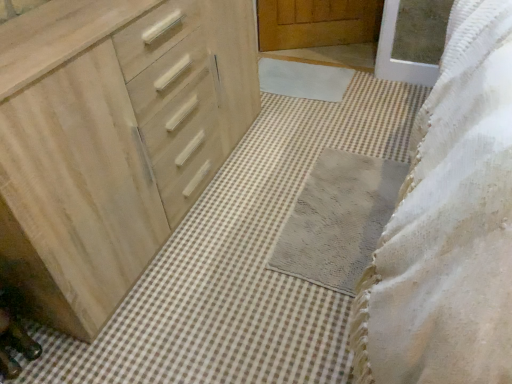
Find the location of a particular element. white soft bath mat at center, arranged as the 1th bath mat when viewed from the top is located at coordinates (303, 79).

Locate an element on the screen. This screenshot has height=384, width=512. natural wood chest of drawers at left is located at coordinates (112, 139).

From a real-world perspective, does white soft bath mat at center, arranged as the second bath mat when ordered from the bottom, stand above natural wood chest of drawers at left?

No, from a real-world perspective, white soft bath mat at center, arranged as the second bath mat when ordered from the bottom, is not over natural wood chest of drawers at left

From the image's perspective, is white soft bath mat at center, arranged as the second bath mat when ordered from the bottom, located above or below natural wood chest of drawers at left?

white soft bath mat at center, arranged as the second bath mat when ordered from the bottom, is above natural wood chest of drawers at left.

Is white soft bath mat at center, arranged as the second bath mat when ordered from the bottom, turned away from natural wood chest of drawers at left?

That's not correct — white soft bath mat at center, arranged as the second bath mat when ordered from the bottom, is not looking away from natural wood chest of drawers at left.

Considering the relative sizes of white soft bath mat at center, marked as the first bath mat in a back-to-front arrangement, and natural wood chest of drawers at left in the image provided, is white soft bath mat at center, marked as the first bath mat in a back-to-front arrangement, shorter than natural wood chest of drawers at left?

Correct, white soft bath mat at center, marked as the first bath mat in a back-to-front arrangement, is not as tall as natural wood chest of drawers at left.

Which object is thinner, gray textured bath mat at center, the 2th bath mat positioned from the back, or natural wood chest of drawers at left?

natural wood chest of drawers at left is thinner.

Considering the sizes of objects gray textured bath mat at center, which ranks as the 2th bath mat in top-to-bottom order, and natural wood chest of drawers at left in the image provided, who is smaller, gray textured bath mat at center, which ranks as the 2th bath mat in top-to-bottom order, or natural wood chest of drawers at left?

gray textured bath mat at center, which ranks as the 2th bath mat in top-to-bottom order, is smaller.

In the image, is gray textured bath mat at center, the 2th bath mat positioned from the back, on the left side or the right side of natural wood chest of drawers at left?

In the image, gray textured bath mat at center, the 2th bath mat positioned from the back, appears on the right side of natural wood chest of drawers at left.

Which is in front, point (348, 164) or point (199, 151)?

The point (199, 151) is more forward.

Considering the positions of point (0, 29) and point (316, 96), is point (0, 29) closer or farther from the camera than point (316, 96)?

Point (0, 29) is positioned closer to the camera compared to point (316, 96).

Looking at their sizes, would you say natural wood chest of drawers at left is wider or thinner than white soft bath mat at center, marked as the first bath mat in a back-to-front arrangement?

Clearly, natural wood chest of drawers at left has less width compared to white soft bath mat at center, marked as the first bath mat in a back-to-front arrangement.

Could you tell me if natural wood chest of drawers at left is turned towards white soft bath mat at center, arranged as the second bath mat when ordered from the bottom?

No, natural wood chest of drawers at left is not turned towards white soft bath mat at center, arranged as the second bath mat when ordered from the bottom.

Does gray textured bath mat at center, the 1th bath mat from the front, have a larger size compared to white soft bath mat at center, marked as the first bath mat in a back-to-front arrangement?

Yes, gray textured bath mat at center, the 1th bath mat from the front, is bigger than white soft bath mat at center, marked as the first bath mat in a back-to-front arrangement.

You are a GUI agent. You are given a task and a screenshot of the screen. Output one action in this format:
    pyautogui.click(x=<x>, y=<y>)
    Task: Click on the bath mat on the left of gray textured bath mat at center, the 1th bath mat from the front
    The width and height of the screenshot is (512, 384).
    Given the screenshot: What is the action you would take?
    (x=303, y=79)

From the image's perspective, is gray textured bath mat at center, the 2th bath mat positioned from the back, above or below white soft bath mat at center, marked as the first bath mat in a back-to-front arrangement?

Clearly, from the image's perspective, gray textured bath mat at center, the 2th bath mat positioned from the back, is below white soft bath mat at center, marked as the first bath mat in a back-to-front arrangement.

Is white soft bath mat at center, marked as the 2th bath mat in a front-to-back arrangement, completely or partially inside gray textured bath mat at center, the 1th bath mat from the front?

No, gray textured bath mat at center, the 1th bath mat from the front, does not contain white soft bath mat at center, marked as the 2th bath mat in a front-to-back arrangement.

Which is in front, point (116, 110) or point (322, 201)?

The point (116, 110) is closer to the camera.

Looking at this image, is natural wood chest of drawers at left not within gray textured bath mat at center, the 1th bath mat from the front?

Yes.

From the image's perspective, is natural wood chest of drawers at left on top of gray textured bath mat at center, the 2th bath mat positioned from the back?

Yes, from the image's perspective, natural wood chest of drawers at left is above gray textured bath mat at center, the 2th bath mat positioned from the back.

Is gray textured bath mat at center, the 1th bath mat from the front, at the back of natural wood chest of drawers at left?

That's not correct — natural wood chest of drawers at left is not looking away from gray textured bath mat at center, the 1th bath mat from the front.

In the image, is white soft bath mat at center, arranged as the 1th bath mat when viewed from the top, on the left side or the right side of gray textured bath mat at center, the 1th bath mat when ordered from bottom to top?

white soft bath mat at center, arranged as the 1th bath mat when viewed from the top, is to the left of gray textured bath mat at center, the 1th bath mat when ordered from bottom to top.

Is point (294, 89) farther from camera compared to point (297, 250)?

Yes.

From a real-world perspective, is white soft bath mat at center, marked as the first bath mat in a back-to-front arrangement, positioned over gray textured bath mat at center, the 1th bath mat from the front, based on gravity?

Yes, from a real-world perspective, white soft bath mat at center, marked as the first bath mat in a back-to-front arrangement, is over gray textured bath mat at center, the 1th bath mat from the front

Does white soft bath mat at center, arranged as the second bath mat when ordered from the bottom, lie behind gray textured bath mat at center, the 1th bath mat from the front?

That is True.

In order to click on the chest of drawers above the white soft bath mat at center, marked as the 2th bath mat in a front-to-back arrangement (from a real-world perspective) in this screenshot , I will do `click(112, 139)`.

Where is `bath mat that is the 2nd one below the natural wood chest of drawers at left (from a real-world perspective)`? This screenshot has width=512, height=384. bath mat that is the 2nd one below the natural wood chest of drawers at left (from a real-world perspective) is located at coordinates pos(338,219).

Estimate the real-world distances between objects in this image. Which object is closer to natural wood chest of drawers at left, white soft bath mat at center, marked as the 2th bath mat in a front-to-back arrangement, or gray textured bath mat at center, the 1th bath mat when ordered from bottom to top?

gray textured bath mat at center, the 1th bath mat when ordered from bottom to top, lies closer to natural wood chest of drawers at left than the other object.

Which object lies nearer to the anchor point white soft bath mat at center, marked as the first bath mat in a back-to-front arrangement, natural wood chest of drawers at left or gray textured bath mat at center, the 1th bath mat when ordered from bottom to top?

Based on the image, gray textured bath mat at center, the 1th bath mat when ordered from bottom to top, appears to be nearer to white soft bath mat at center, marked as the first bath mat in a back-to-front arrangement.

Which object lies further to the anchor point gray textured bath mat at center, the 2th bath mat positioned from the back, white soft bath mat at center, arranged as the second bath mat when ordered from the bottom, or natural wood chest of drawers at left?

Based on the image, white soft bath mat at center, arranged as the second bath mat when ordered from the bottom, appears to be further to gray textured bath mat at center, the 2th bath mat positioned from the back.

Which object lies further to the anchor point natural wood chest of drawers at left, gray textured bath mat at center, the 1th bath mat from the front, or white soft bath mat at center, arranged as the 1th bath mat when viewed from the top?

Among the two, white soft bath mat at center, arranged as the 1th bath mat when viewed from the top, is located further to natural wood chest of drawers at left.

Considering their positions, is gray textured bath mat at center, the 1th bath mat when ordered from bottom to top, positioned further to white soft bath mat at center, arranged as the second bath mat when ordered from the bottom, than natural wood chest of drawers at left?

Based on the image, natural wood chest of drawers at left appears to be further to white soft bath mat at center, arranged as the second bath mat when ordered from the bottom.

Looking at the image, which one is located closer to gray textured bath mat at center, the 2th bath mat positioned from the back, natural wood chest of drawers at left or white soft bath mat at center, marked as the 2th bath mat in a front-to-back arrangement?

The object closer to gray textured bath mat at center, the 2th bath mat positioned from the back, is natural wood chest of drawers at left.

Where is `bath mat located between natural wood chest of drawers at left and white soft bath mat at center, arranged as the 1th bath mat when viewed from the top, in the depth direction`? Image resolution: width=512 pixels, height=384 pixels. bath mat located between natural wood chest of drawers at left and white soft bath mat at center, arranged as the 1th bath mat when viewed from the top, in the depth direction is located at coordinates (338, 219).